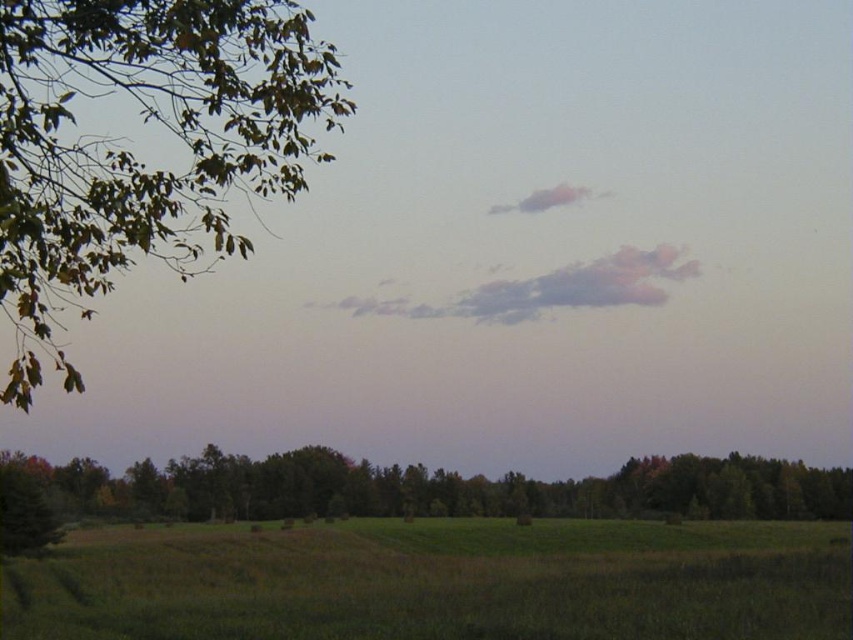
Question: Observing the image, what is the correct spatial positioning of green grassy field at lower center in reference to green leafy tree at lower center?

Choices:
 (A) left
 (B) right

Answer: (B)

Question: Which point is closer to the camera?

Choices:
 (A) green grassy field at lower center
 (B) green leafy tree at upper left
 (C) pink cotton cloud at upper center
 (D) green leafy tree at lower center

Answer: (B)

Question: Considering the real-world distances, which object is farthest from the pink cotton cloud at upper center?

Choices:
 (A) pink fluffy cloud at upper center
 (B) green leafy tree at upper left

Answer: (B)

Question: Can you confirm if green leafy tree at upper left is positioned to the right of pink fluffy cloud at upper center?

Choices:
 (A) no
 (B) yes

Answer: (A)

Question: Which point is closer to the camera?

Choices:
 (A) tap(509, 204)
 (B) tap(177, 467)
 (C) tap(363, 548)
 (D) tap(432, 307)

Answer: (C)

Question: Is green leafy tree at lower center bigger than pink cotton cloud at upper center?

Choices:
 (A) yes
 (B) no

Answer: (A)